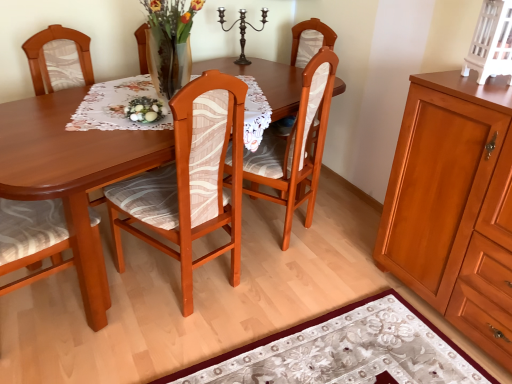
Where is `free location to the right of wooden chair at center, positioned as the 2th chair in right-to-left order`? The width and height of the screenshot is (512, 384). free location to the right of wooden chair at center, positioned as the 2th chair in right-to-left order is located at coordinates (268, 294).